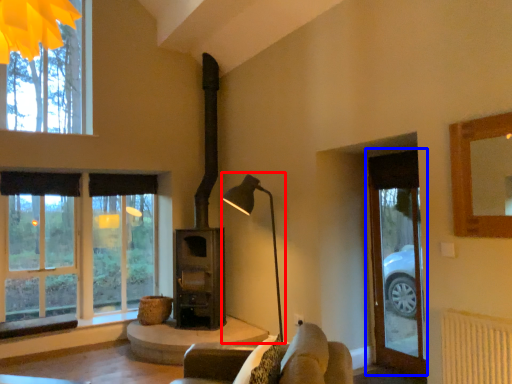
Question: Which object appears closest to the camera in this image, table lamp (highlighted by a red box) or glass door (highlighted by a blue box)?

Choices:
 (A) table lamp
 (B) glass door

Answer: (B)